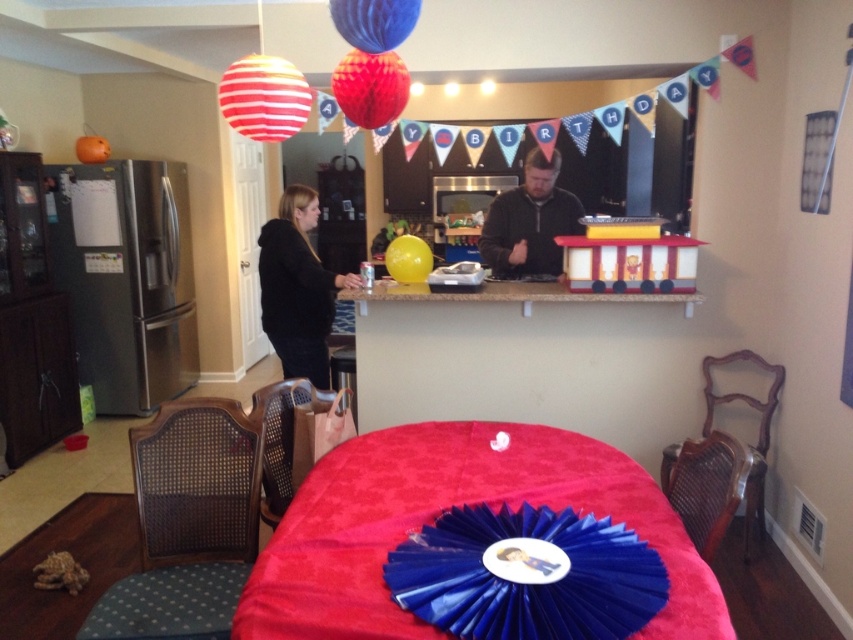
Question: Among these points, which one is nearest to the camera?

Choices:
 (A) (283, 314)
 (B) (381, 13)

Answer: (B)

Question: Which point is farther to the camera?

Choices:
 (A) (345, 10)
 (B) (323, 276)
 (C) (239, 93)
 (D) (415, 250)

Answer: (D)

Question: Among these objects, which one is farthest from the camera?

Choices:
 (A) black fleece jacket at center
 (B) striped paper balloon at upper left
 (C) red velvet table at center
 (D) blue glossy balloon at upper center

Answer: (A)

Question: Can you confirm if red velvet table at center is wider than blue glossy balloon at upper center?

Choices:
 (A) no
 (B) yes

Answer: (B)

Question: Does red velvet table at center appear on the left side of shiny red balloon at upper center?

Choices:
 (A) yes
 (B) no

Answer: (B)

Question: Is red velvet table at center to the left of blue glossy balloon at upper center from the viewer's perspective?

Choices:
 (A) yes
 (B) no

Answer: (B)